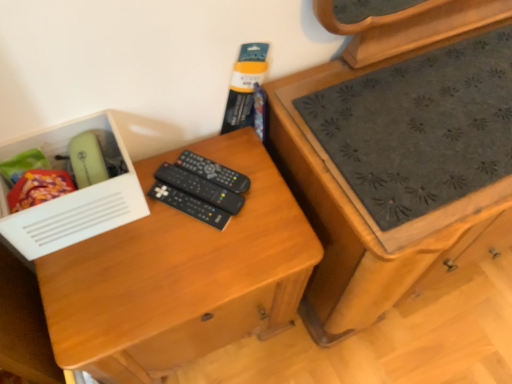
Locate an element on the screen. The image size is (512, 384). vacant area to the right of white plastic box at left is located at coordinates (170, 237).